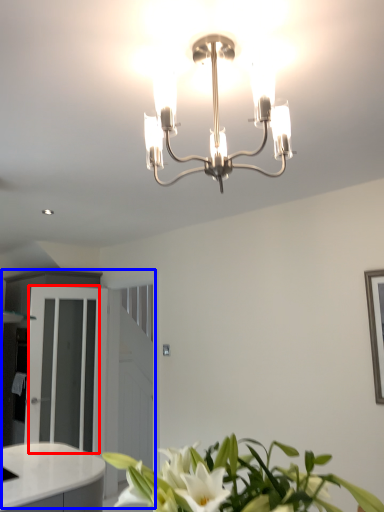
Question: Among these objects, which one is nearest to the camera, glass door (highlighted by a red box) or dresser (highlighted by a blue box)?

Choices:
 (A) glass door
 (B) dresser

Answer: (A)